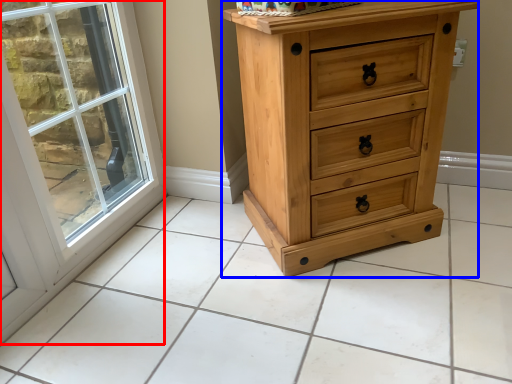
Question: Which object is closer to the camera taking this photo, window (highlighted by a red box) or chest of drawers (highlighted by a blue box)?

Choices:
 (A) window
 (B) chest of drawers

Answer: (A)